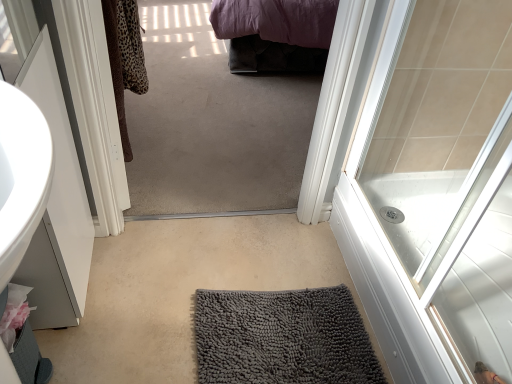
Identify the location of vacant space behind gray chenille bath mat at center. This screenshot has width=512, height=384. [267, 252].